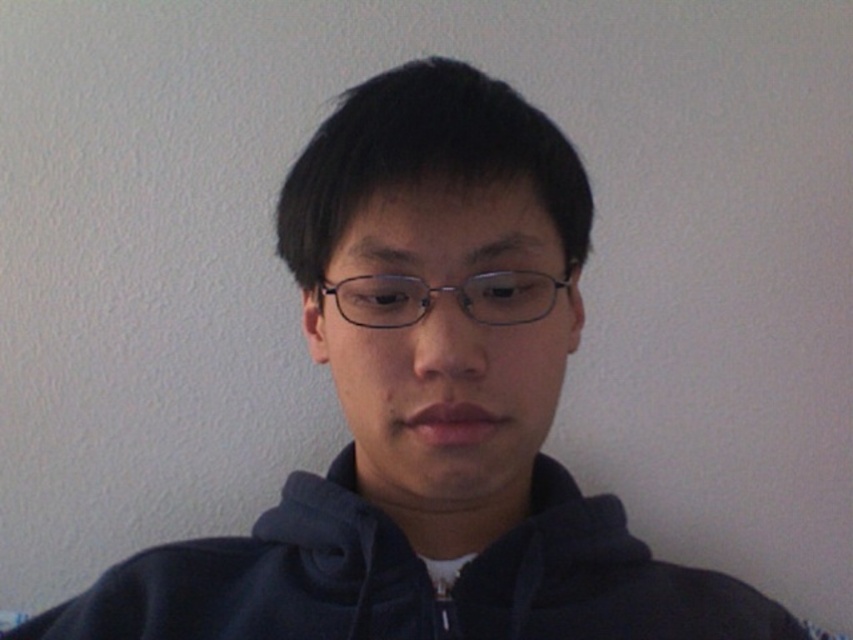
Identify the location of dark blue fleece sweatshirt at center. (413, 579).

Consider the image. Which is more to the right, dark blue fleece sweatshirt at center or clear plastic glasses at center?

Positioned to the right is clear plastic glasses at center.

This screenshot has height=640, width=853. Find the location of `dark blue fleece sweatshirt at center`. dark blue fleece sweatshirt at center is located at coordinates (413, 579).